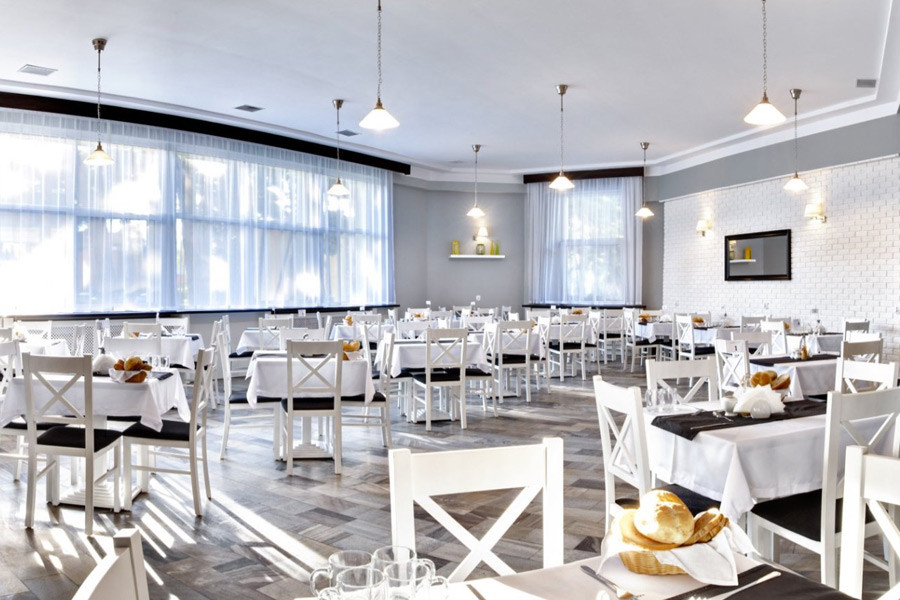
Where is `bread baskets`? The height and width of the screenshot is (600, 900). bread baskets is located at coordinates (671, 522), (763, 374), (698, 321), (644, 315), (574, 310), (416, 314), (346, 316), (349, 344), (127, 364), (787, 325).